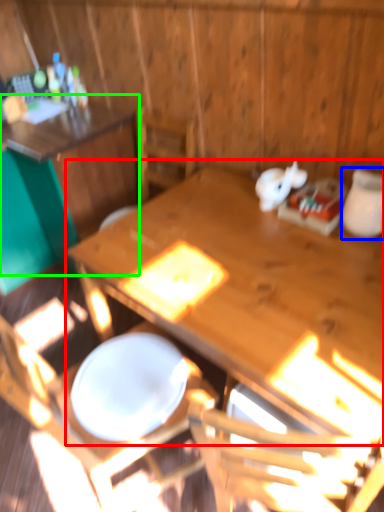
Question: Which object is the farthest from table (highlighted by a red box)? Choose among these: tableware (highlighted by a blue box) or table (highlighted by a green box).

Choices:
 (A) tableware
 (B) table

Answer: (B)